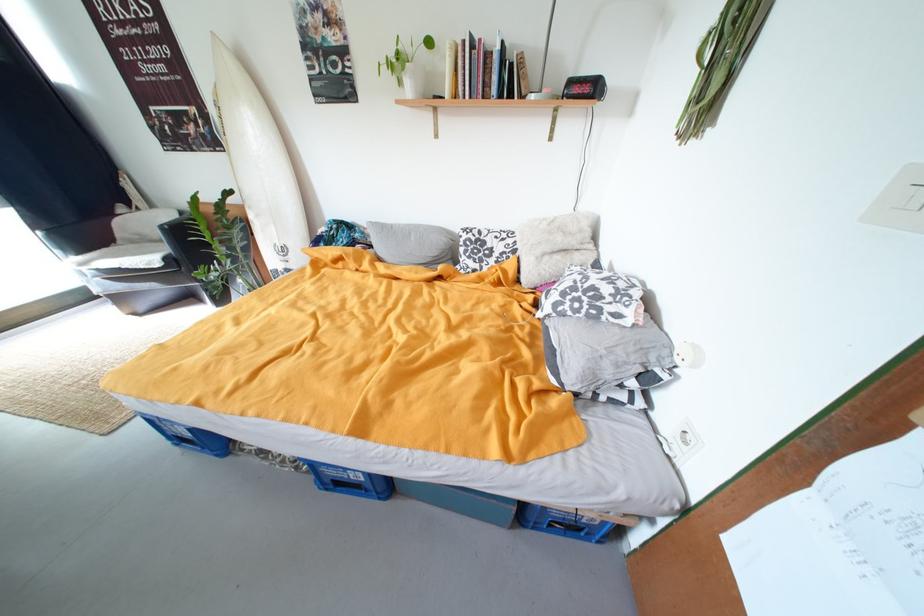
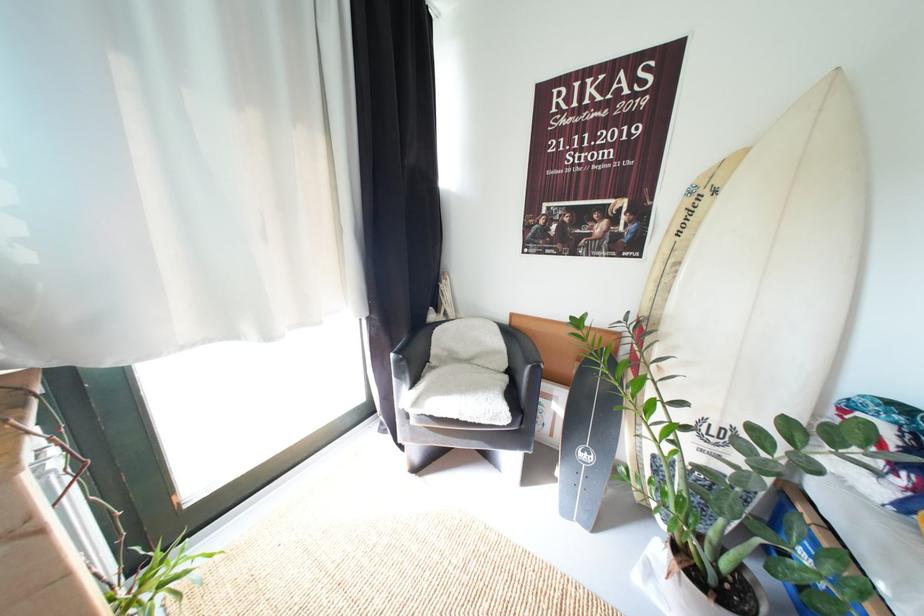
Question: Which direction would the cameraman need to move to produce the second image? Reply with the corresponding letter.

Choices:
 (A) Left
 (B) Right
 (C) Forward
 (D) Backward

Answer: (A)